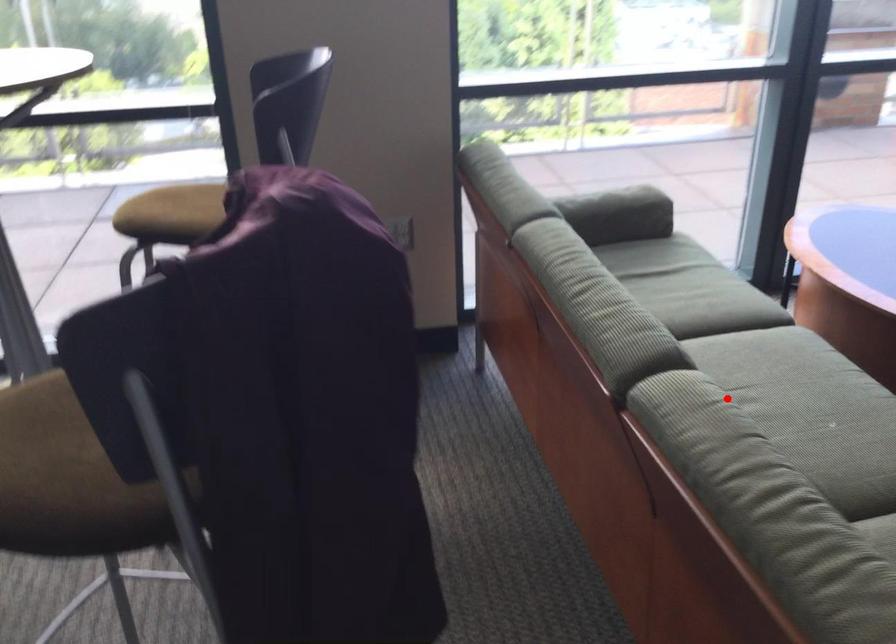
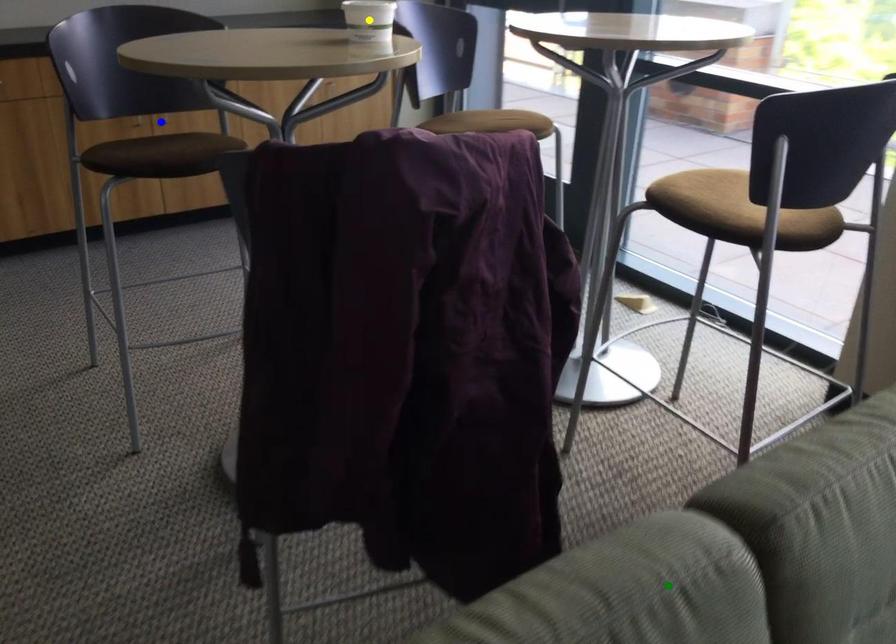
Question: I am providing you with two images of the same scene from different viewpoints. A red point is marked on the first image. You are given multiple points on the second image. Can you choose the point in image 2 that corresponds to the point in image 1?

Choices:
 (A) green point
 (B) yellow point
 (C) blue point

Answer: (A)